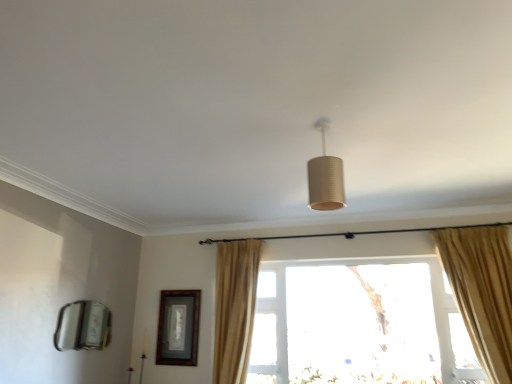
Question: Is matte cardboard lampshade at center bigger than wooden framed picture at center left?

Choices:
 (A) yes
 (B) no

Answer: (A)

Question: Does matte cardboard lampshade at center have a lesser height compared to wooden framed picture at center left?

Choices:
 (A) yes
 (B) no

Answer: (A)

Question: Is matte cardboard lampshade at center oriented away from wooden framed picture at center left?

Choices:
 (A) no
 (B) yes

Answer: (A)

Question: Is matte cardboard lampshade at center not within wooden framed picture at center left?

Choices:
 (A) no
 (B) yes

Answer: (B)

Question: Can you confirm if matte cardboard lampshade at center is positioned to the left of wooden framed picture at center left?

Choices:
 (A) no
 (B) yes

Answer: (A)

Question: Considering their positions, is matte cardboard lampshade at center located in front of or behind transparent glass window at center?

Choices:
 (A) behind
 (B) front

Answer: (B)

Question: Is matte cardboard lampshade at center to the left or to the right of transparent glass window at center in the image?

Choices:
 (A) left
 (B) right

Answer: (A)

Question: From a real-world perspective, is matte cardboard lampshade at center above or below transparent glass window at center?

Choices:
 (A) below
 (B) above

Answer: (B)

Question: In terms of height, does matte cardboard lampshade at center look taller or shorter compared to transparent glass window at center?

Choices:
 (A) short
 (B) tall

Answer: (A)

Question: Looking at the image, does beige fabric curtain at center seem bigger or smaller compared to transparent glass window at center?

Choices:
 (A) small
 (B) big

Answer: (B)

Question: From the image's perspective, is beige fabric curtain at center positioned above or below transparent glass window at center?

Choices:
 (A) below
 (B) above

Answer: (B)

Question: In terms of height, does beige fabric curtain at center look taller or shorter compared to transparent glass window at center?

Choices:
 (A) tall
 (B) short

Answer: (A)

Question: Considering their positions, is beige fabric curtain at center located in front of or behind transparent glass window at center?

Choices:
 (A) behind
 (B) front

Answer: (B)

Question: From their relative heights in the image, would you say transparent glass window at center is taller or shorter than wooden framed picture at center left?

Choices:
 (A) tall
 (B) short

Answer: (A)

Question: From a real-world perspective, is transparent glass window at center positioned above or below wooden framed picture at center left?

Choices:
 (A) above
 (B) below

Answer: (A)